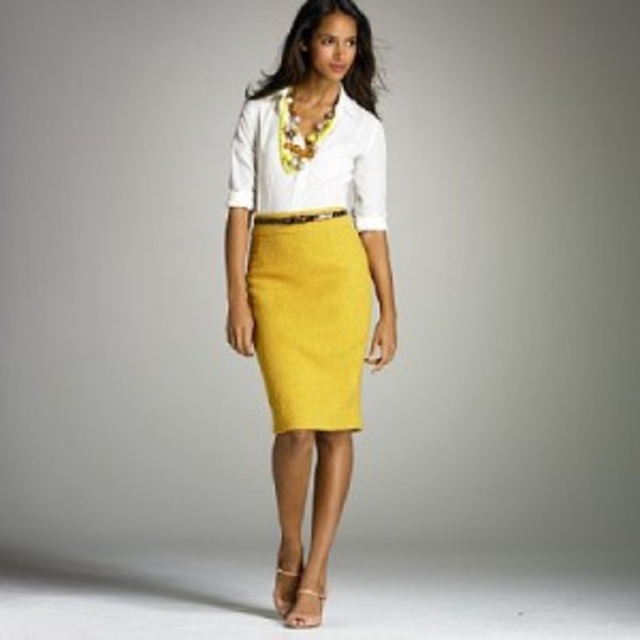
Is matte yellow pencil skirt at center wider than white cotton shirt at center?

No.

Does matte yellow pencil skirt at center appear under white cotton shirt at center?

Yes, matte yellow pencil skirt at center is below white cotton shirt at center.

Between point (284, 336) and point (385, 170), which one is positioned in front?

Point (284, 336) is more forward.

Where is `matte yellow pencil skirt at center`? The image size is (640, 640). matte yellow pencil skirt at center is located at coordinates (308, 317).

Which of these two, matte yellow skirt at center or matte yellow pencil skirt at center, stands shorter?

With less height is matte yellow pencil skirt at center.

Who is more forward, (348, 406) or (285, 276)?

Positioned in front is point (348, 406).

This screenshot has height=640, width=640. I want to click on matte yellow skirt at center, so click(310, 272).

Which is in front, point (278, 225) or point (317, 148)?

Point (317, 148) is more forward.

Looking at this image, between matte yellow skirt at center and white cotton shirt at center, which one has less height?

white cotton shirt at center

Locate an element on the screen. This screenshot has width=640, height=640. matte yellow skirt at center is located at coordinates click(x=310, y=272).